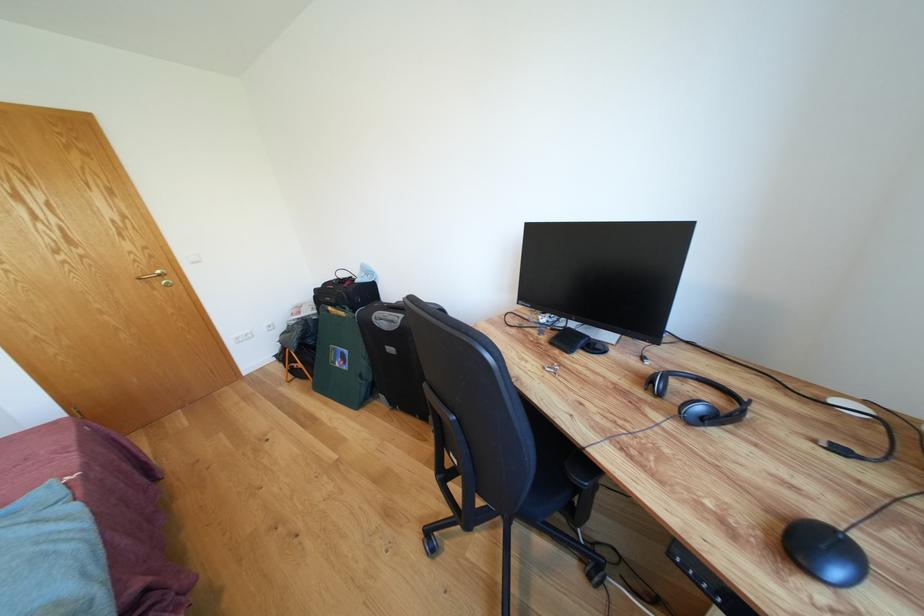
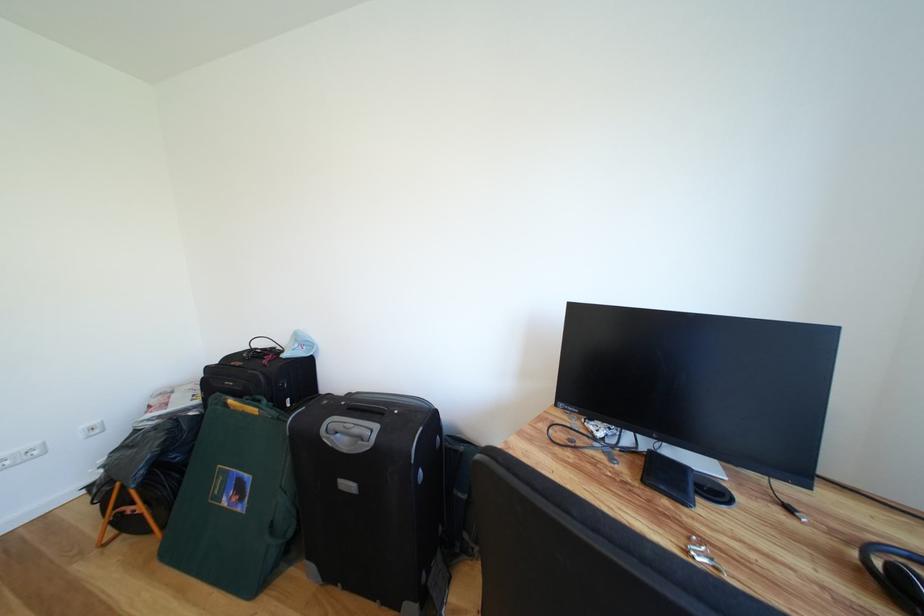
Where in the second image is the point corresponding to the point at 346,369 from the first image?

(234, 506)